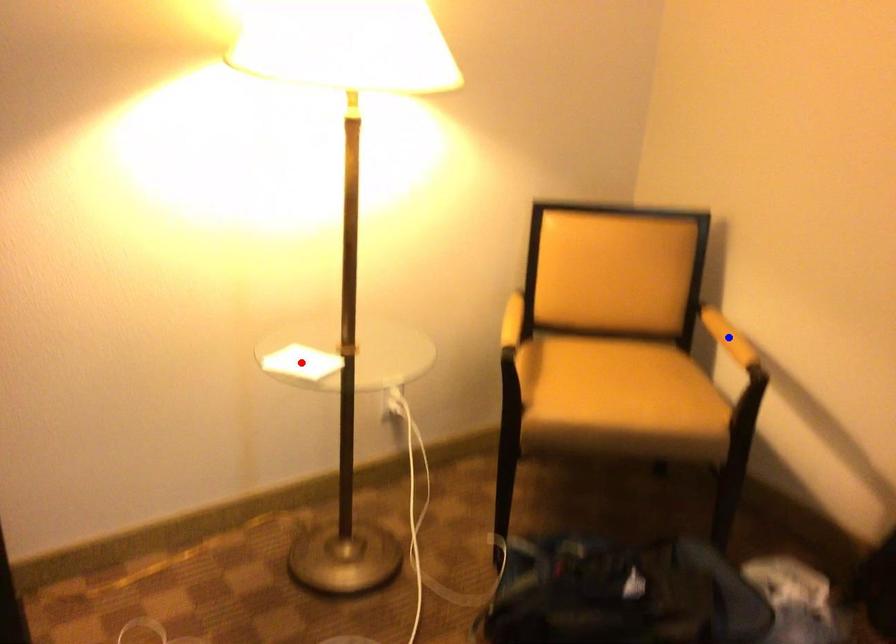
Question: In the image, two points are highlighted. Which point is nearer to the camera? Reply with the corresponding letter.

Choices:
 (A) blue point
 (B) red point

Answer: (B)